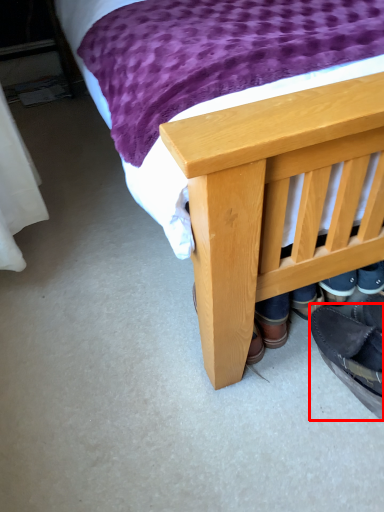
Question: From the image's perspective, what is the correct spatial relationship of footwear (annotated by the red box) in relation to bed?

Choices:
 (A) below
 (B) above

Answer: (A)